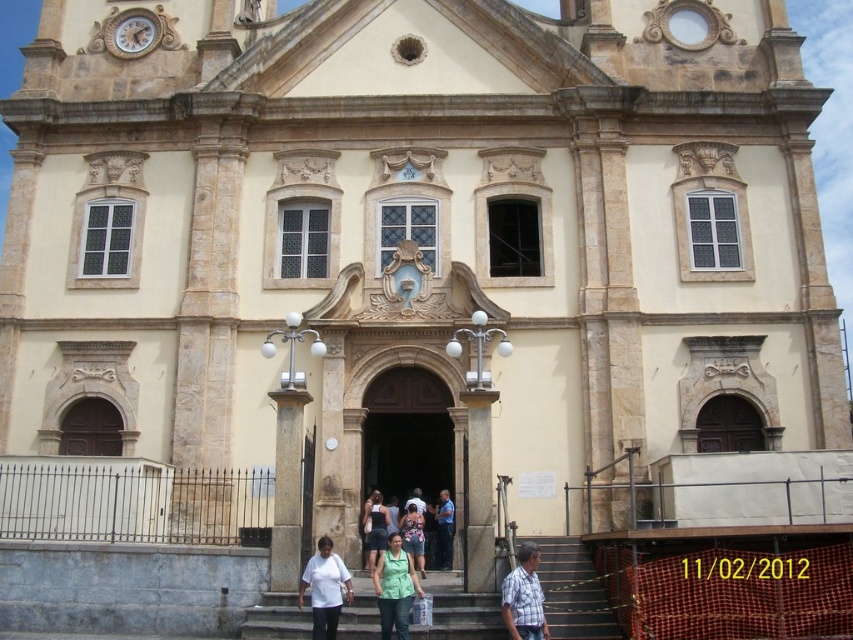
Is the position of green matte shirt at center less distant than that of dark blue uniform at center?

Yes, it is in front of dark blue uniform at center.

Can you confirm if green matte shirt at center is thinner than dark blue uniform at center?

Indeed, green matte shirt at center has a lesser width compared to dark blue uniform at center.

Locate an element on the screen. The width and height of the screenshot is (853, 640). green matte shirt at center is located at coordinates (393, 588).

Is white matte shirt at center to the left of denim shorts at center from the viewer's perspective?

Yes, white matte shirt at center is to the left of denim shorts at center.

Who is lower down, white matte shirt at center or denim shorts at center?

denim shorts at center is below.

Does point (326, 584) lie in front of point (418, 534)?

Yes, point (326, 584) is closer to viewer.

Identify the location of white matte shirt at center. (325, 588).

Find the location of a particular element. This screenshot has width=853, height=640. stone stairs at center is located at coordinates (573, 592).

Is point (442, 632) closer to viewer compared to point (508, 579)?

No, it is behind (508, 579).

The height and width of the screenshot is (640, 853). In order to click on stone stairs at center in this screenshot , I will do `click(573, 592)`.